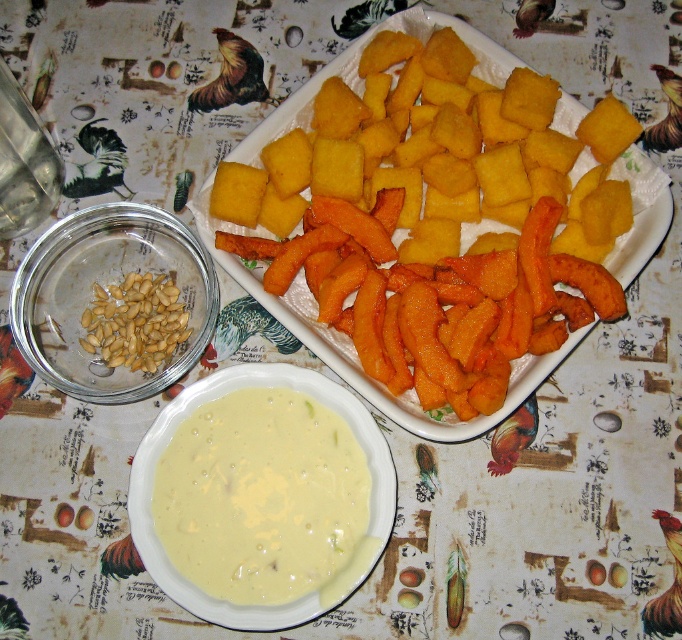
Question: Which object is closer to the camera taking this photo?

Choices:
 (A) creamy smooth soup at center
 (B) yellow fried polenta at center
 (C) orange crispy carrot at center

Answer: (A)

Question: Which of the following is the closest to the observer?

Choices:
 (A) (83, 340)
 (B) (379, 436)

Answer: (B)

Question: Based on their relative distances, which object is farther from the golden brown seeds at left?

Choices:
 (A) creamy smooth soup at center
 (B) light brown smooth nuts at center left

Answer: (A)

Question: Does golden brown seeds at left have a lesser width compared to creamy smooth soup at center?

Choices:
 (A) yes
 (B) no

Answer: (A)

Question: Can you confirm if orange crispy carrot at center is thinner than yellow fried polenta at center?

Choices:
 (A) yes
 (B) no

Answer: (A)

Question: Can you confirm if golden brown seeds at left is positioned above creamy smooth soup at center?

Choices:
 (A) no
 (B) yes

Answer: (B)